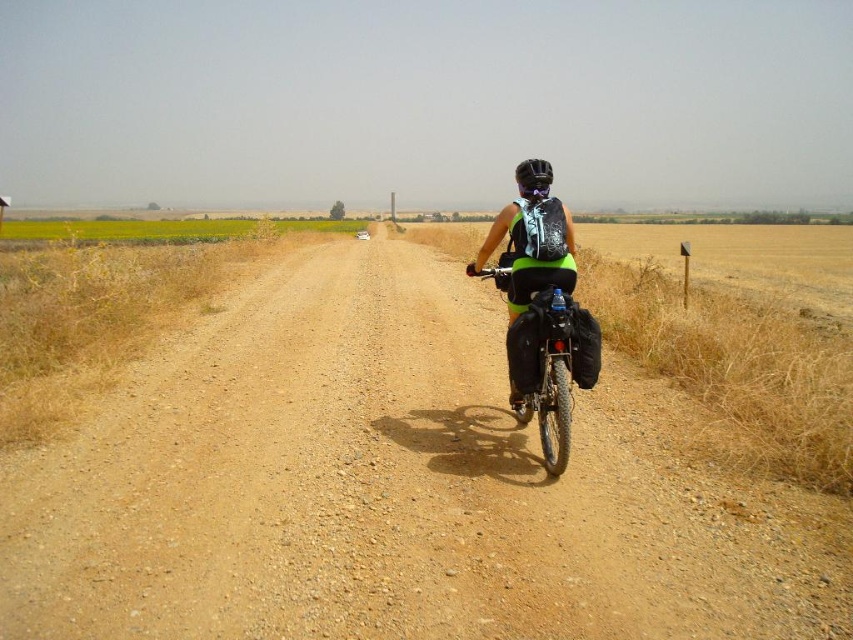
You are planning to ride your green fabric bicycle at center along the brown gravel dirt track at center. Considering the size of the track and the bicycle, will there be enough space for the bicycle to ride comfortably without needing to go off the track?

The brown gravel dirt track at center is larger in size than green fabric bicycle at center, so there will be enough space for the green fabric bicycle at center to ride comfortably without needing to go off the track.

Based on the photo, you are a cyclist planning to ride through the scene shown. You notice the brown gravel dirt track at center and the matte black backpack at center. Which object is lower in height?

The brown gravel dirt track at center has a lesser height compared to the matte black backpack at center, so the dirt track is lower.

Consider the image. You are the cyclist in the image. You want to ride your green fabric bicycle at center along the brown gravel dirt track at center. Can you safely ride your bicycle on the track without worrying about the width of the track being an issue?

The brown gravel dirt track at center might be wider than green fabric bicycle at center, so it is likely safe to ride the green fabric bicycle at center on the track as the track may accommodate its width.